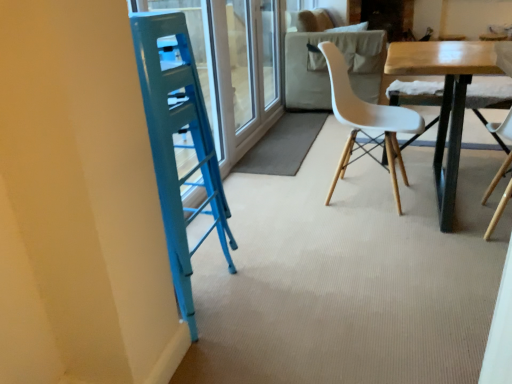
Where is `wooden table at center`? This screenshot has width=512, height=384. wooden table at center is located at coordinates (445, 101).

The width and height of the screenshot is (512, 384). What are the coordinates of `transparent glass screen door at upper center` in the screenshot? It's located at (247, 70).

There is a white matte plastic chair at center. Where is `screen door above it (from a real-world perspective)`? screen door above it (from a real-world perspective) is located at coordinates (247, 70).

Does point (244, 19) lie in front of point (396, 189)?

No.

Looking at this image, from the image's perspective, which object appears higher, transparent glass screen door at upper center or white matte plastic chair at center?

transparent glass screen door at upper center appears higher in the image.

From a real-world perspective, is transparent glass screen door at upper center positioned over white matte plastic chair at center based on gravity?

Correct, in the physical world, transparent glass screen door at upper center is higher than white matte plastic chair at center.

From a real-world perspective, who is located lower, wooden table at center or transparent glass screen door at upper center?

In real-world perspective, wooden table at center is lower.

Can we say wooden table at center lies outside transparent glass screen door at upper center?

Indeed, wooden table at center is completely outside transparent glass screen door at upper center.

From the image's perspective, does wooden table at center appear lower than transparent glass screen door at upper center?

Yes, from the image's perspective, wooden table at center is below transparent glass screen door at upper center.

The height and width of the screenshot is (384, 512). I want to click on screen door that appears above the wooden table at center (from a real-world perspective), so click(247, 70).

From a real-world perspective, which is physically below, white matte plastic chair at center or wooden table at center?

From a 3D spatial view, wooden table at center is below.

Does white matte plastic chair at center have a larger size compared to wooden table at center?

Incorrect, white matte plastic chair at center is not larger than wooden table at center.

Measure the distance between white matte plastic chair at center and wooden table at center.

A distance of 13.63 inches exists between white matte plastic chair at center and wooden table at center.

Image resolution: width=512 pixels, height=384 pixels. Find the location of `table in front of the white matte plastic chair at center`. table in front of the white matte plastic chair at center is located at coordinates (445, 101).

Is wooden table at center to the right of white matte plastic chair at center from the viewer's perspective?

Indeed, wooden table at center is positioned on the right side of white matte plastic chair at center.

Looking at this image, from the image's perspective, relative to white matte plastic chair at center, is wooden table at center above or below?

Based on their image positions, wooden table at center is located beneath white matte plastic chair at center.

Is wooden table at center inside transparent glass screen door at upper center?

No, wooden table at center is not surrounded by transparent glass screen door at upper center.

Which object is thinner, transparent glass screen door at upper center or wooden table at center?

Thinner between the two is transparent glass screen door at upper center.

From a real-world perspective, is transparent glass screen door at upper center positioned above or below wooden table at center?

transparent glass screen door at upper center is above wooden table at center.

In the scene shown: From the image's perspective, who appears lower, transparent glass screen door at upper center or wooden table at center?

wooden table at center, from the image's perspective.

How distant is white matte plastic chair at center from transparent glass screen door at upper center?

A distance of 38.56 inches exists between white matte plastic chair at center and transparent glass screen door at upper center.

Can you confirm if white matte plastic chair at center is shorter than transparent glass screen door at upper center?

Yes, white matte plastic chair at center is shorter than transparent glass screen door at upper center.

Is white matte plastic chair at center not near transparent glass screen door at upper center?

Actually, white matte plastic chair at center and transparent glass screen door at upper center are a little close together.

How many degrees apart are the facing directions of white matte plastic chair at center and transparent glass screen door at upper center?

0.684 degrees.

Where is `chair located underneath the transparent glass screen door at upper center (from a real-world perspective)`? chair located underneath the transparent glass screen door at upper center (from a real-world perspective) is located at coordinates (366, 121).

Locate an element on the screen. table located in front of the transparent glass screen door at upper center is located at coordinates (445, 101).

Estimate the real-world distances between objects in this image. Which object is closer to wooden table at center, white matte plastic chair at center or transparent glass screen door at upper center?

Based on the image, white matte plastic chair at center appears to be nearer to wooden table at center.

Considering their positions, is transparent glass screen door at upper center positioned further to wooden table at center than white matte plastic chair at center?

transparent glass screen door at upper center.

Which object lies nearer to the anchor point transparent glass screen door at upper center, white matte plastic chair at center or wooden table at center?

The object closer to transparent glass screen door at upper center is white matte plastic chair at center.

When comparing their distances from white matte plastic chair at center, does transparent glass screen door at upper center or wooden table at center seem closer?

The object closer to white matte plastic chair at center is wooden table at center.

Considering their positions, is wooden table at center positioned closer to white matte plastic chair at center than transparent glass screen door at upper center?

The object closer to white matte plastic chair at center is wooden table at center.

Estimate the real-world distances between objects in this image. Which object is further from transparent glass screen door at upper center, wooden table at center or white matte plastic chair at center?

wooden table at center is positioned further to the anchor transparent glass screen door at upper center.

The height and width of the screenshot is (384, 512). What are the coordinates of `chair between transparent glass screen door at upper center and wooden table at center in the horizontal direction` in the screenshot? It's located at (366, 121).